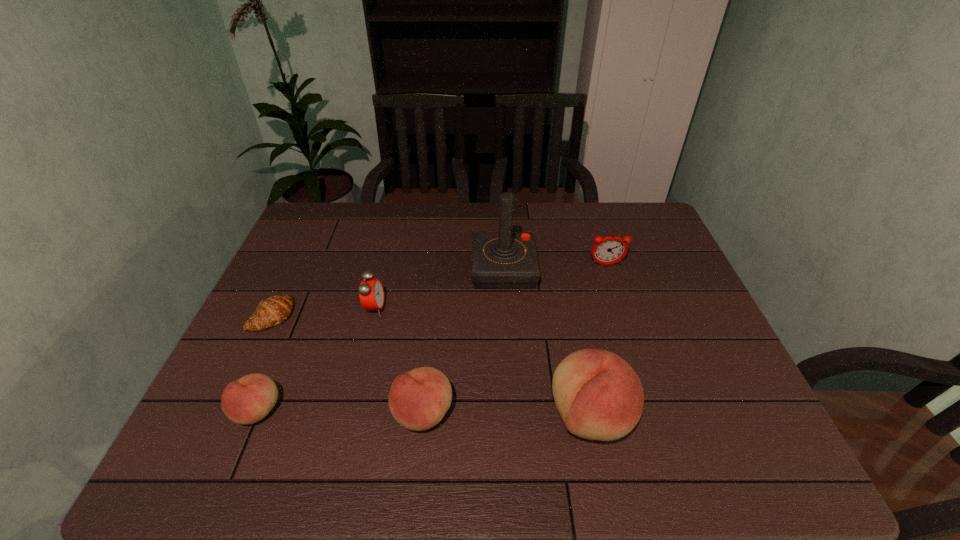
At what (x,y) coordinates should I click in order to perform the action: click on vacant space that satisfies the following two spatial constraints: 1. on the front-facing side of the right alarm clock; 2. on the rectangular base of the joystick. Please return your answer as a coordinate pair (x, y). The width and height of the screenshot is (960, 540). Looking at the image, I should click on (608, 269).

The height and width of the screenshot is (540, 960). What are the coordinates of `vacant space that satisfies the following two spatial constraints: 1. on the rectangular base of the joystick; 2. on the front side of the shortest peach` in the screenshot? It's located at (512, 410).

Locate an element on the screen. The width and height of the screenshot is (960, 540). free space in the image that satisfies the following two spatial constraints: 1. on the front-facing side of the second peach from left to right; 2. on the left side of the left alarm clock is located at coordinates (349, 413).

The width and height of the screenshot is (960, 540). I want to click on vacant region that satisfies the following two spatial constraints: 1. on the front-facing side of the left alarm clock; 2. on the left side of the rightmost peach, so click(348, 416).

Where is `free space that satisfies the following two spatial constraints: 1. on the front side of the shortest object; 2. on the right side of the rightmost peach`? This screenshot has width=960, height=540. free space that satisfies the following two spatial constraints: 1. on the front side of the shortest object; 2. on the right side of the rightmost peach is located at coordinates (225, 416).

You are a GUI agent. You are given a task and a screenshot of the screen. Output one action in this format:
    pyautogui.click(x=<x>, y=<y>)
    Task: Click on the vacant area that satisfies the following two spatial constraints: 1. on the front-facing side of the right alarm clock; 2. on the rectangular base of the tallest object
    
    Given the screenshot: What is the action you would take?
    pyautogui.click(x=608, y=269)